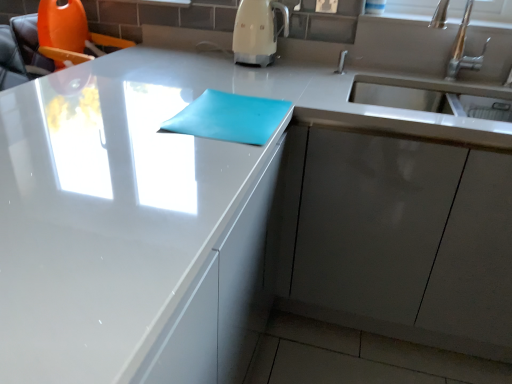
Question: Would you say white glossy coffee machine at upper center is to the left or to the right of matte blue notepad at center in the picture?

Choices:
 (A) right
 (B) left

Answer: (A)

Question: Is white glossy coffee machine at upper center inside or outside of matte blue notepad at center?

Choices:
 (A) inside
 (B) outside

Answer: (B)

Question: Which of these objects is positioned farthest from the white glossy coffee machine at upper center?

Choices:
 (A) matte gray cabinet at lower right
 (B) matte blue notepad at center

Answer: (A)

Question: Which is nearer to the white glossy coffee machine at upper center?

Choices:
 (A) matte blue notepad at center
 (B) matte gray cabinet at lower right

Answer: (A)